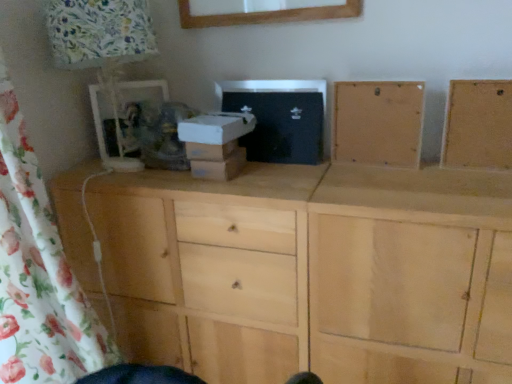
At what (x,y) coordinates should I click in order to perform the action: click on free point in front of light wood cabinet at center, the first cabinetry positioned from the left. Please return your answer as a coordinate pair (x, y). Looking at the image, I should click on (394, 178).